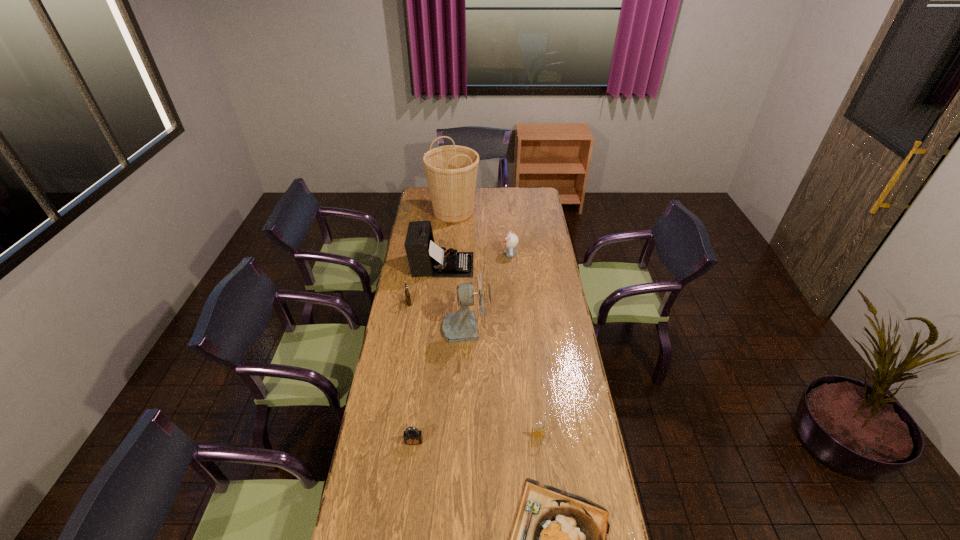
This screenshot has height=540, width=960. Find the location of `vacant region located 0.110m in front of the seventh shortest object to blow air`. vacant region located 0.110m in front of the seventh shortest object to blow air is located at coordinates (514, 326).

Identify the location of vacant region located 0.090m inside the open case of the typewriter. The width and height of the screenshot is (960, 540). (491, 265).

At what (x,y) coordinates should I click in order to perform the action: click on vacant point located 0.180m on the front-facing side of the kitten. Please return your answer as a coordinate pair (x, y). This screenshot has width=960, height=540. Looking at the image, I should click on (470, 254).

At what (x,y) coordinates should I click in order to perform the action: click on free spot located on the front-facing side of the kitten. Please return your answer as a coordinate pair (x, y). The image size is (960, 540). Looking at the image, I should click on (483, 254).

Identify the location of vacant space situated 0.310m on the front-facing side of the kitten. (447, 254).

You are a GUI agent. You are given a task and a screenshot of the screen. Output one action in this format:
    pyautogui.click(x=<x>, y=<y>)
    Task: Click on the vacant space located 0.230m on the front of the tallest padlock
    The image size is (960, 540).
    Given the screenshot: What is the action you would take?
    pyautogui.click(x=401, y=342)

This screenshot has width=960, height=540. What are the coordinates of `vacant space located 0.050m on the front of the second padlock from right to left near the keyhole` in the screenshot? It's located at (412, 459).

Find the location of a particular element. Image resolution: width=960 pixels, height=540 pixels. free region located 0.080m on the front-facing side of the rightmost padlock is located at coordinates (540, 458).

Where is `object that is at the far edge`? The width and height of the screenshot is (960, 540). object that is at the far edge is located at coordinates (451, 170).

Where is `basket present at the left edge`? basket present at the left edge is located at coordinates (451, 170).